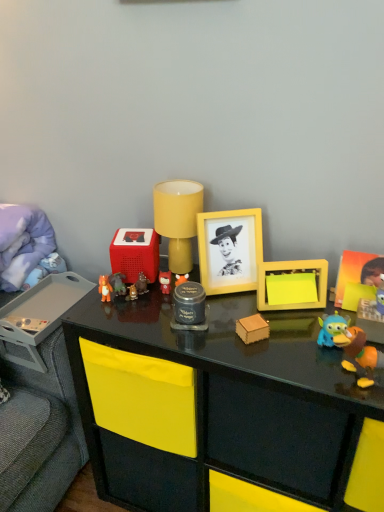
What is the approximate width of matte black jar at center, the 5th toy viewed from the right?

matte black jar at center, the 5th toy viewed from the right, is 4.41 inches in width.

What is the approximate width of blue rubber duck at right, the 10th toy in the left-to-right sequence?

blue rubber duck at right, the 10th toy in the left-to-right sequence, is 5.28 centimeters wide.

What do you see at coordinates (331, 328) in the screenshot? I see `blue rubber duck at right, the 10th toy in the left-to-right sequence` at bounding box center [331, 328].

Find the location of a particular element. The width and height of the screenshot is (384, 512). rubberized plastic speaker at center, positioned as the fourth toy in left-to-right order is located at coordinates (135, 253).

The width and height of the screenshot is (384, 512). What do you see at coordinates (135, 253) in the screenshot? I see `rubberized plastic speaker at center, the 8th toy when ordered from right to left` at bounding box center [135, 253].

Find the location of a particular element. metallic gray tray at left is located at coordinates (39, 315).

The width and height of the screenshot is (384, 512). I want to click on wooden block at center, which is counted as the fourth toy, starting from the right, so click(x=252, y=329).

Locate an element on the screen. Image resolution: width=384 pixels, height=512 pixels. matte plastic toy at center, the tenth toy when ordered from right to left is located at coordinates (118, 284).

Image resolution: width=384 pixels, height=512 pixels. Identify the location of matte black jar at center, the 5th toy viewed from the right. (189, 307).

From the picture: Is yellow matte picture frame at upper right, the first picture frame from the right, far from orange rubber toy at right, the 11th toy positioned from the left?

yellow matte picture frame at upper right, the first picture frame from the right, is actually quite close to orange rubber toy at right, the 11th toy positioned from the left.

Is yellow matte picture frame at upper right, the first picture frame from the right, wider than orange rubber toy at right, the 11th toy positioned from the left?

In fact, yellow matte picture frame at upper right, the first picture frame from the right, might be narrower than orange rubber toy at right, the 11th toy positioned from the left.

Which object is positioned more to the left, yellow matte picture frame at upper right, the first picture frame from the right, or orange rubber toy at right, the 11th toy positioned from the left?

orange rubber toy at right, the 11th toy positioned from the left, is more to the left.

From a real-world perspective, count 1st picture frames upward from the orange rubber toy at right, the 11th toy positioned from the left, and point to it. Please provide its 2D coordinates.

[(357, 274)]

Considering the sizes of objects yellow matte table lamp at center and metallic gold figurine at center, which is the 3th toy in left-to-right order, in the image provided, who is thinner, yellow matte table lamp at center or metallic gold figurine at center, which is the 3th toy in left-to-right order,?

With smaller width is metallic gold figurine at center, which is the 3th toy in left-to-right order.

Is yellow matte table lamp at center at the right side of metallic gold figurine at center, marked as the 9th toy in a right-to-left arrangement?

Yes, yellow matte table lamp at center is to the right of metallic gold figurine at center, marked as the 9th toy in a right-to-left arrangement.

Between yellow matte table lamp at center and metallic gold figurine at center, marked as the 9th toy in a right-to-left arrangement, which one is positioned in front?

yellow matte table lamp at center is more forward.

How much distance is there between yellow matte sticky notes at center-right, marked as the 3th toy in a right-to-left arrangement, and yellow matte picture frame at center, the second picture frame viewed from the right?

12.60 centimeters.

From a real-world perspective, is yellow matte sticky notes at center-right, marked as the 3th toy in a right-to-left arrangement, positioned above or below yellow matte picture frame at center, the second picture frame viewed from the right?

yellow matte sticky notes at center-right, marked as the 3th toy in a right-to-left arrangement, is situated lower than yellow matte picture frame at center, the second picture frame viewed from the right, in the real world.

Can you confirm if yellow matte sticky notes at center-right, marked as the ninth toy in a left-to-right arrangement, is positioned to the left of yellow matte picture frame at center, acting as the first picture frame starting from the left?

No, yellow matte sticky notes at center-right, marked as the ninth toy in a left-to-right arrangement, is not to the left of yellow matte picture frame at center, acting as the first picture frame starting from the left.

Is yellow matte sticky notes at center-right, marked as the ninth toy in a left-to-right arrangement, with yellow matte picture frame at center, acting as the first picture frame starting from the left?

yellow matte sticky notes at center-right, marked as the ninth toy in a left-to-right arrangement, and yellow matte picture frame at center, acting as the first picture frame starting from the left, are clearly separated.

Is the depth of metallic gold figurine at center, which is the 3th toy in left-to-right order, greater than that of yellow matte picture frame at center, acting as the first picture frame starting from the left?

Yes, metallic gold figurine at center, which is the 3th toy in left-to-right order, is further from the camera.

Are metallic gold figurine at center, marked as the 9th toy in a right-to-left arrangement, and yellow matte picture frame at center, acting as the first picture frame starting from the left, beside each other?

No, metallic gold figurine at center, marked as the 9th toy in a right-to-left arrangement, is not in contact with yellow matte picture frame at center, acting as the first picture frame starting from the left.

Considering the sizes of objects metallic gold figurine at center, marked as the 9th toy in a right-to-left arrangement, and yellow matte picture frame at center, the second picture frame viewed from the right, in the image provided, who is thinner, metallic gold figurine at center, marked as the 9th toy in a right-to-left arrangement, or yellow matte picture frame at center, the second picture frame viewed from the right,?

metallic gold figurine at center, marked as the 9th toy in a right-to-left arrangement, is thinner.

How much distance is there between metallic gold figurine at center, which is the 3th toy in left-to-right order, and yellow matte picture frame at center, acting as the first picture frame starting from the left?

10.97 inches.

How many degrees apart are the facing directions of matte plastic toy at center, positioned as the 2th toy in left-to-right order, and metallic gray tray at left?

There is a 28.5-degree angle between the facing directions of matte plastic toy at center, positioned as the 2th toy in left-to-right order, and metallic gray tray at left.

Is matte plastic toy at center, the tenth toy when ordered from right to left, not near metallic gray tray at left?

No.

Is point (126, 290) less distant than point (49, 309)?

Yes, point (126, 290) is in front of point (49, 309).

Does matte plastic toy at center, positioned as the 2th toy in left-to-right order, have a smaller size compared to black glossy desk at center?

Yes.

Is matte plastic toy at center, positioned as the 2th toy in left-to-right order, surrounding black glossy desk at center?

That's incorrect, black glossy desk at center is not inside matte plastic toy at center, positioned as the 2th toy in left-to-right order.

Could you tell me if matte plastic toy at center, the tenth toy when ordered from right to left, is turned towards black glossy desk at center?

No, matte plastic toy at center, the tenth toy when ordered from right to left, is not turned towards black glossy desk at center.

Is matte plastic toy at center, positioned as the 2th toy in left-to-right order, in front of black glossy desk at center?

No, matte plastic toy at center, positioned as the 2th toy in left-to-right order, is further to the viewer.

In terms of size, does blue rubber duck at right, acting as the 2th toy starting from the right, appear bigger or smaller than black glossy desk at center?

A: Considering their sizes, blue rubber duck at right, acting as the 2th toy starting from the right, takes up less space than black glossy desk at center.

From the picture: How much distance is there between blue rubber duck at right, acting as the 2th toy starting from the right, and black glossy desk at center?

blue rubber duck at right, acting as the 2th toy starting from the right, and black glossy desk at center are 15.30 inches apart from each other.

From the image's perspective, would you say blue rubber duck at right, acting as the 2th toy starting from the right, is shown under black glossy desk at center?

Actually, blue rubber duck at right, acting as the 2th toy starting from the right, appears above black glossy desk at center in the image.

From a real-world perspective, which is physically above, blue rubber duck at right, acting as the 2th toy starting from the right, or black glossy desk at center?

blue rubber duck at right, acting as the 2th toy starting from the right.

This screenshot has height=512, width=384. In order to click on picture frame that is the 1st object located above the orange rubber toy at right, the 11th toy positioned from the left (from the image's perspective) in this screenshot , I will do `click(357, 274)`.

There is a yellow matte table lamp at center. Where is `the 7th toy below it (from the image's perspective)`? The image size is (384, 512). the 7th toy below it (from the image's perspective) is located at coordinates (132, 293).

Based on their spatial positions, is orange rubber toy at right, the 11th toy positioned from the left, or yellow matte picture frame at center, the second picture frame viewed from the right, further from yellow matte table lamp at center?

Based on the image, orange rubber toy at right, the 11th toy positioned from the left, appears to be further to yellow matte table lamp at center.

Considering their positions, is metallic gray tray at left positioned closer to matte plastic toy at center, positioned as the sixth toy in right-to-left order, than black glossy desk at center?

black glossy desk at center.

Which object lies further to the anchor point rubberized plastic speaker at center, the 8th toy when ordered from right to left, matte plastic toy at center, the tenth toy when ordered from right to left, or wooden block at center, which is counted as the fourth toy, starting from the right?

Based on the image, wooden block at center, which is counted as the fourth toy, starting from the right, appears to be further to rubberized plastic speaker at center, the 8th toy when ordered from right to left.

Estimate the real-world distances between objects in this image. Which object is further from matte black jar at center, the seventh toy viewed from the left, matte orange bear at center-left, placed as the eleventh toy when sorted from right to left, or orange rubber toy at right, which ranks as the first toy in right-to-left order?

Among the two, orange rubber toy at right, which ranks as the first toy in right-to-left order, is located further to matte black jar at center, the seventh toy viewed from the left.

Based on their spatial positions, is matte plastic toy at center, which is the sixth toy from left to right, or matte plastic toy at center, the tenth toy when ordered from right to left, closer to orange rubber toy at right, which ranks as the first toy in right-to-left order?

matte plastic toy at center, which is the sixth toy from left to right.

Looking at the image, which one is located closer to yellow matte picture frame at center, acting as the first picture frame starting from the left, yellow matte sticky notes at center-right, marked as the ninth toy in a left-to-right arrangement, or matte plastic toy at center, which is the seventh toy in right-to-left order?

yellow matte sticky notes at center-right, marked as the ninth toy in a left-to-right arrangement, is positioned closer to the anchor yellow matte picture frame at center, acting as the first picture frame starting from the left.

Estimate the real-world distances between objects in this image. Which object is further from yellow matte sticky notes at center-right, marked as the 3th toy in a right-to-left arrangement, black glossy desk at center or metallic gold figurine at center, marked as the 9th toy in a right-to-left arrangement?

metallic gold figurine at center, marked as the 9th toy in a right-to-left arrangement, is positioned further to the anchor yellow matte sticky notes at center-right, marked as the 3th toy in a right-to-left arrangement.

From the image, which object appears to be nearer to metallic gray tray at left, matte black jar at center, the seventh toy viewed from the left, or black glossy desk at center?

The object closer to metallic gray tray at left is black glossy desk at center.

What are the coordinates of `picture frame between matte plastic toy at center, placed as the 5th toy when sorted from left to right, and orange rubber toy at right, which ranks as the first toy in right-to-left order, in the horizontal direction` in the screenshot? It's located at pos(229,250).

This screenshot has height=512, width=384. In order to click on desk situated between matte plastic toy at center, the tenth toy when ordered from right to left, and blue rubber duck at right, the 10th toy in the left-to-right sequence, from left to right in this screenshot , I will do `click(227, 405)`.

What are the coordinates of `picture frame that lies between yellow matte sticky notes at center-right, marked as the 3th toy in a right-to-left arrangement, and black glossy desk at center from top to bottom` in the screenshot? It's located at (357, 274).

At what (x,y) coordinates should I click in order to perform the action: click on table lamp situated between matte orange bear at center-left, placed as the eleventh toy when sorted from right to left, and blue rubber duck at right, acting as the 2th toy starting from the right, from left to right. Please return your answer as a coordinate pair (x, y). Image resolution: width=384 pixels, height=512 pixels. Looking at the image, I should click on (178, 219).